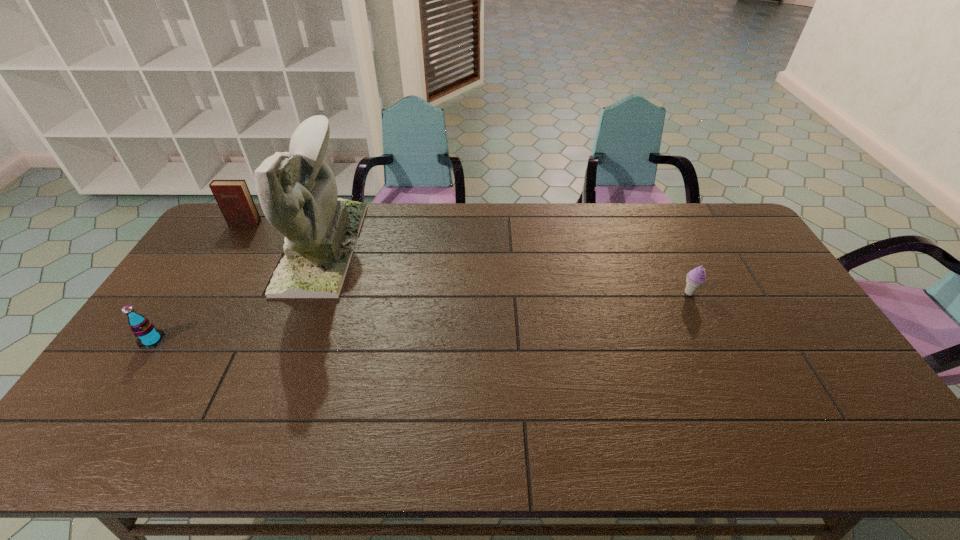
What are the coordinates of `the third object from left to right` in the screenshot? It's located at (297, 190).

The image size is (960, 540). In order to click on sculpture in this screenshot , I will do `click(297, 190)`.

You are a GUI agent. You are given a task and a screenshot of the screen. Output one action in this format:
    pyautogui.click(x=<x>, y=<y>)
    Task: Click on the second tallest object
    This screenshot has width=960, height=540.
    Given the screenshot: What is the action you would take?
    pyautogui.click(x=233, y=197)

This screenshot has width=960, height=540. What are the coordinates of `soda` in the screenshot? It's located at pyautogui.click(x=147, y=335).

This screenshot has width=960, height=540. Find the location of `the second shortest object`. the second shortest object is located at coordinates (147, 335).

Locate an element on the screen. The height and width of the screenshot is (540, 960). the shortest object is located at coordinates (695, 278).

Locate an element on the screen. This screenshot has height=540, width=960. icecream is located at coordinates (695, 278).

Where is `free space located on the base of the second object from right to left`? This screenshot has height=540, width=960. free space located on the base of the second object from right to left is located at coordinates (374, 247).

You are a GUI agent. You are given a task and a screenshot of the screen. Output one action in this format:
    pyautogui.click(x=<x>, y=<y>)
    Task: Click on the blank space located 0.330m on the front cover of the diary
    
    Given the screenshot: What is the action you would take?
    pyautogui.click(x=202, y=291)

Find the location of a particular element. Image resolution: width=960 pixels, height=540 pixels. vacant region located on the back of the nearest object is located at coordinates (216, 245).